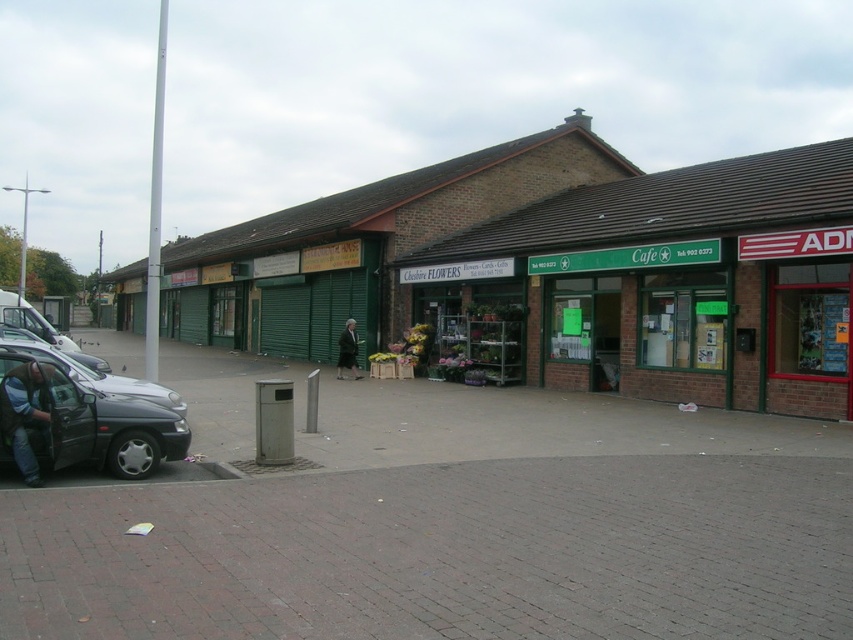
You are a pedestrian standing in front of the cafe. You see a matte black van at lower left and a shiny silver car at left. Which vehicle is closer to the cafe entrance?

The matte black van at lower left is closer to the cafe entrance because it is positioned to the right of the shiny silver car at left, meaning it is nearer to the cafe compared to the other vehicle.

You are standing at the center of the street in front of the cafe. You want to walk to the matte black van at lower left. Which direction should you face to walk straight towards it?

You should face towards the lower left direction to walk straight towards the matte black van at lower left.